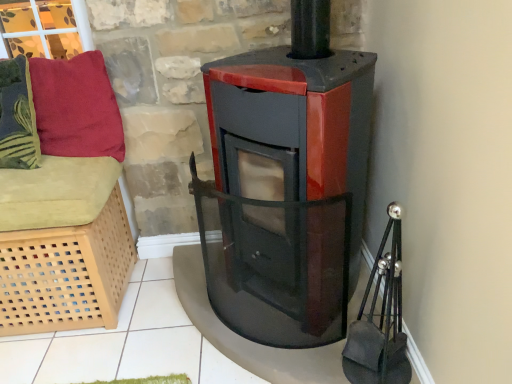
Question: From a real-world perspective, is velvety green pillow at left, the 1th pillow when ordered from left to right, above or below velvety red pillow at upper left, the 1th pillow viewed from the right?

Choices:
 (A) below
 (B) above

Answer: (B)

Question: Is velvety green pillow at left, the 1th pillow when ordered from left to right, to the left or to the right of velvety red pillow at upper left, the 1th pillow viewed from the right, in the image?

Choices:
 (A) left
 (B) right

Answer: (A)

Question: Considering the real-world distances, which object is farthest from the velvety green pillow at left, the 2th pillow when ordered from right to left?

Choices:
 (A) light wood lattice basket at left
 (B) velvety red pillow at upper left, which ranks as the second pillow in left-to-right order

Answer: (A)

Question: Which object is positioned closest to the velvety green pillow at left, the 2th pillow when ordered from right to left?

Choices:
 (A) light wood lattice basket at left
 (B) velvety red pillow at upper left, the 1th pillow viewed from the right

Answer: (B)